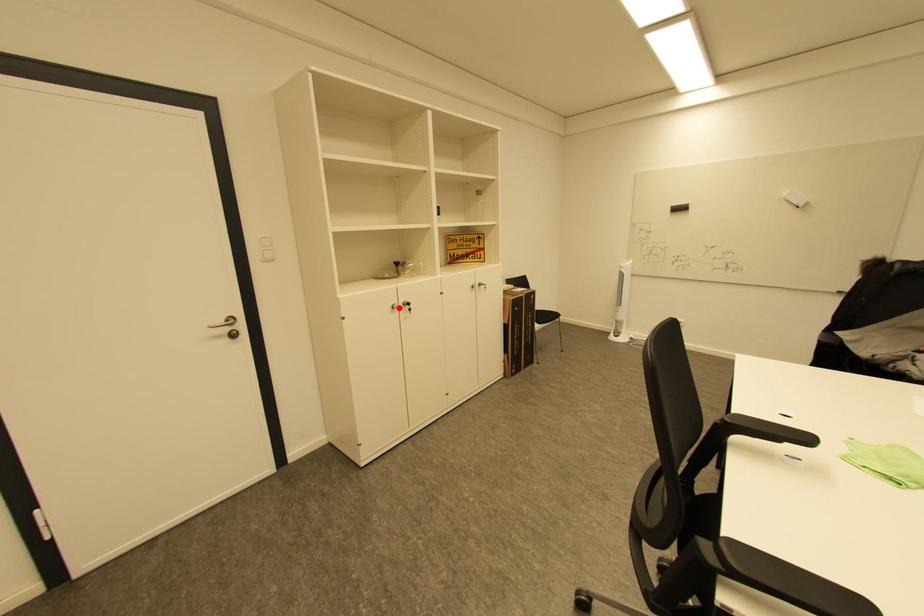
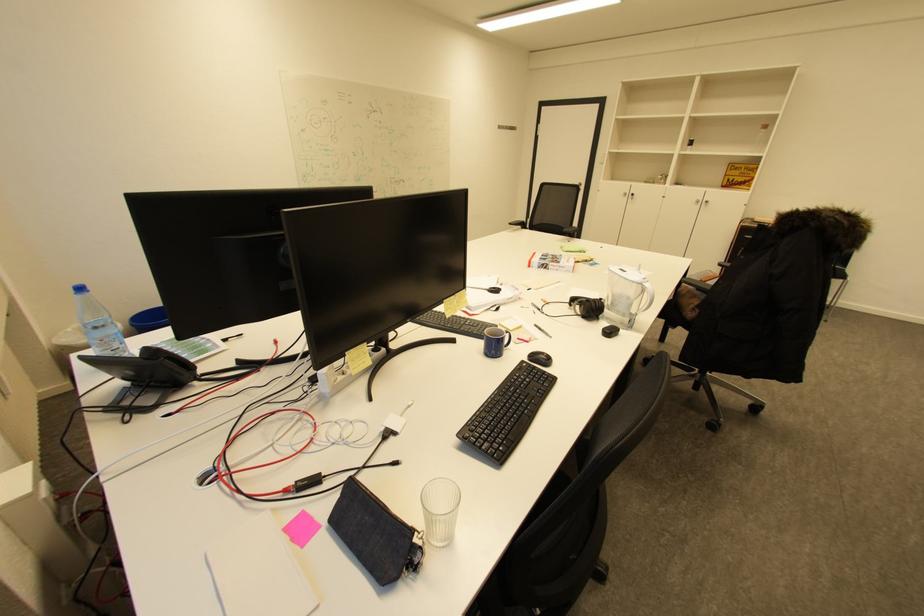
Where in the second image is the point corresponding to the highlighted location from the first image?

(630, 195)